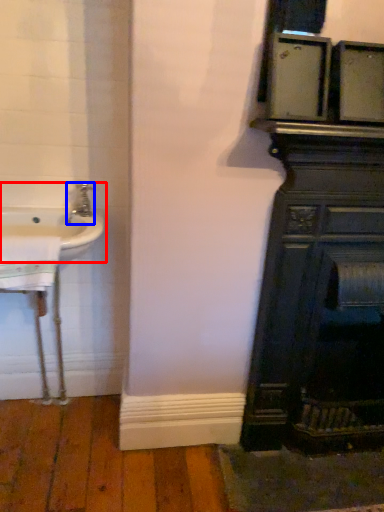
Question: Which object appears closest to the camera in this image, sink (highlighted by a red box) or tap (highlighted by a blue box)?

Choices:
 (A) sink
 (B) tap

Answer: (A)